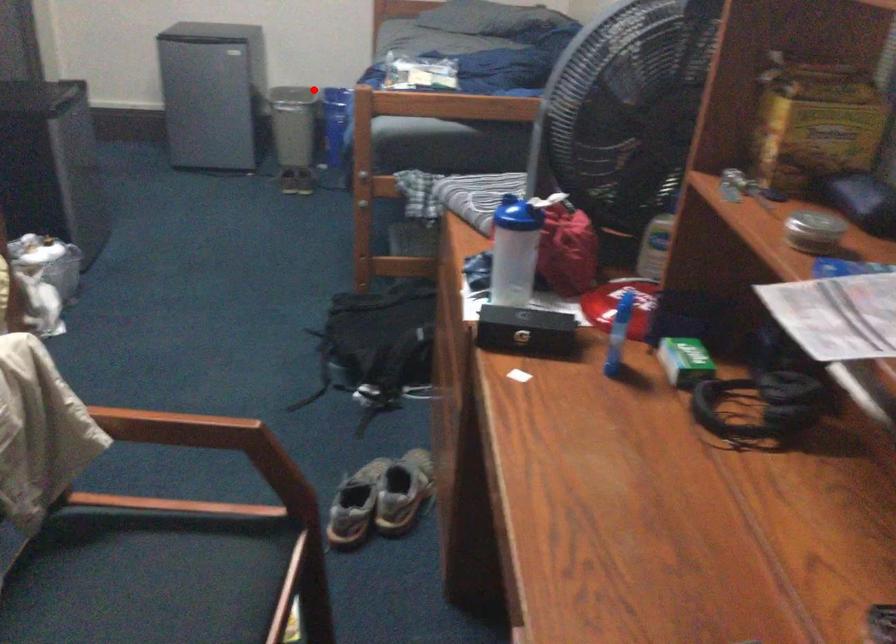
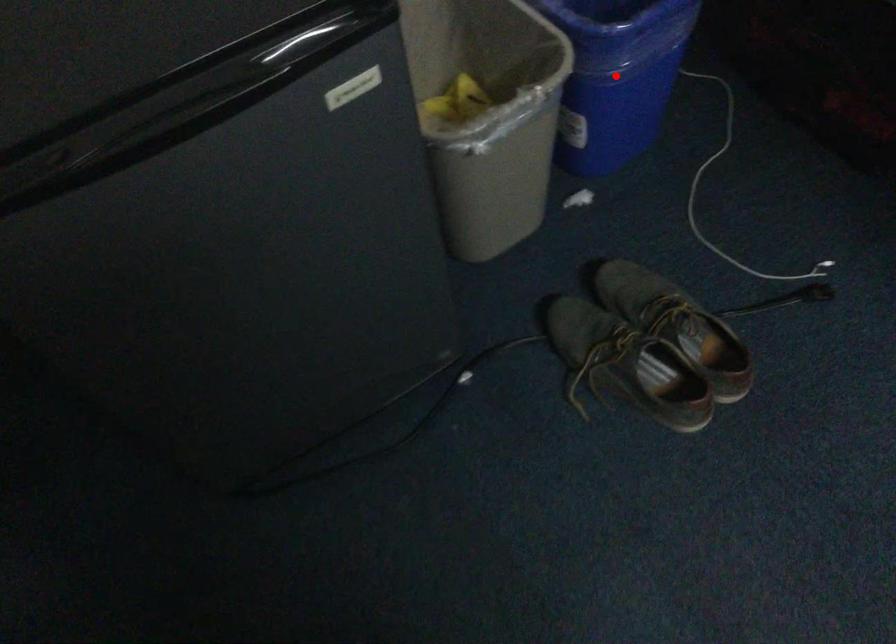
I am providing you with two images of the same scene from different viewpoints. A red point is marked on the first image and another point is marked on the second image. Is the red point in image1 aligned with the point shown in image2?

Yes